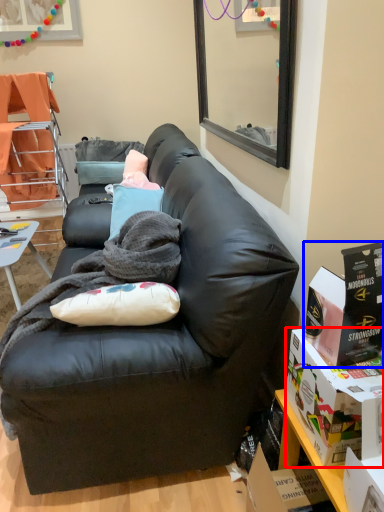
Question: Among these objects, which one is nearest to the camera, box (highlighted by a red box) or box (highlighted by a blue box)?

Choices:
 (A) box
 (B) box

Answer: (A)